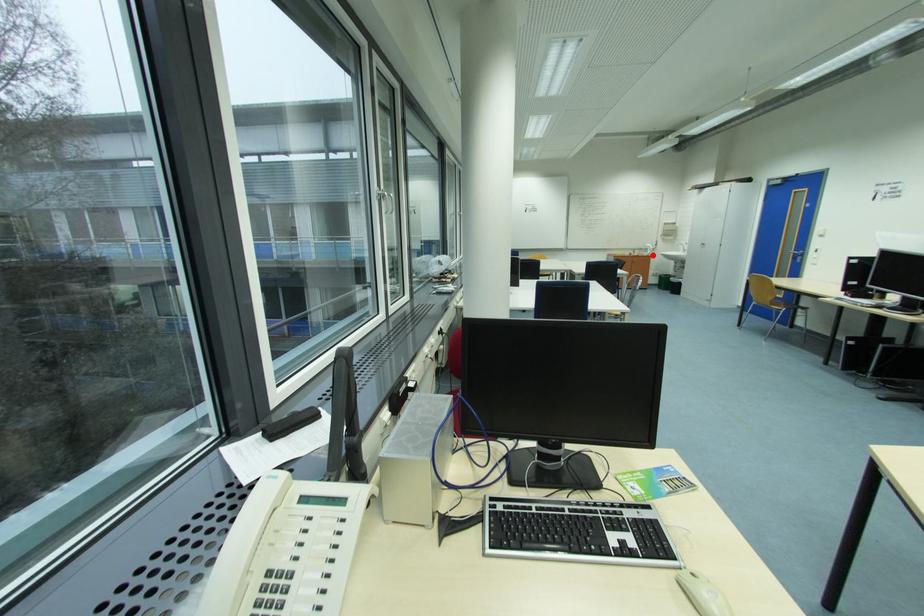
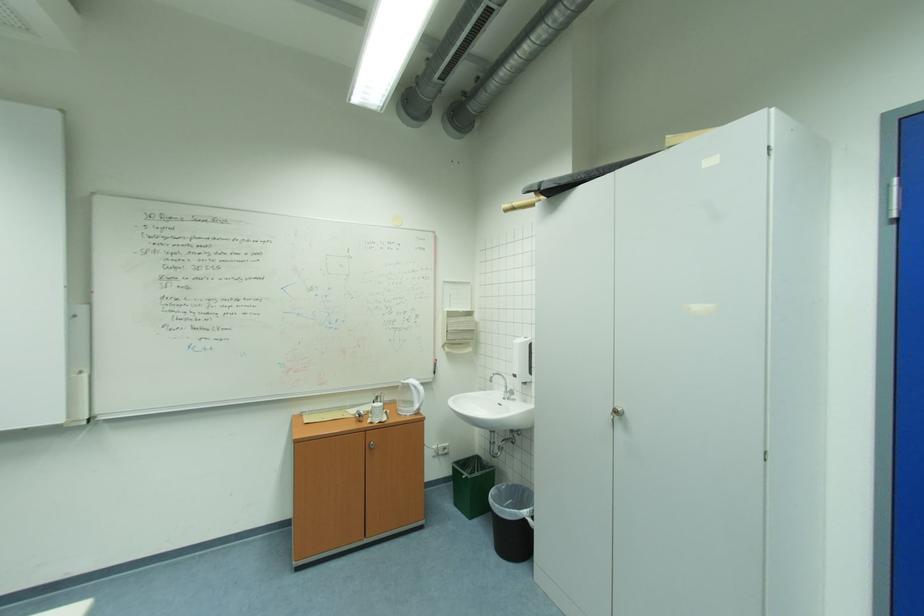
Question: I am providing you with two images of the same scene from different viewpoints. A red point is shown in image1. For the corresponding object point in image2, is it positioned nearer or farther from the camera?

Choices:
 (A) Nearer
 (B) Farther

Answer: (B)